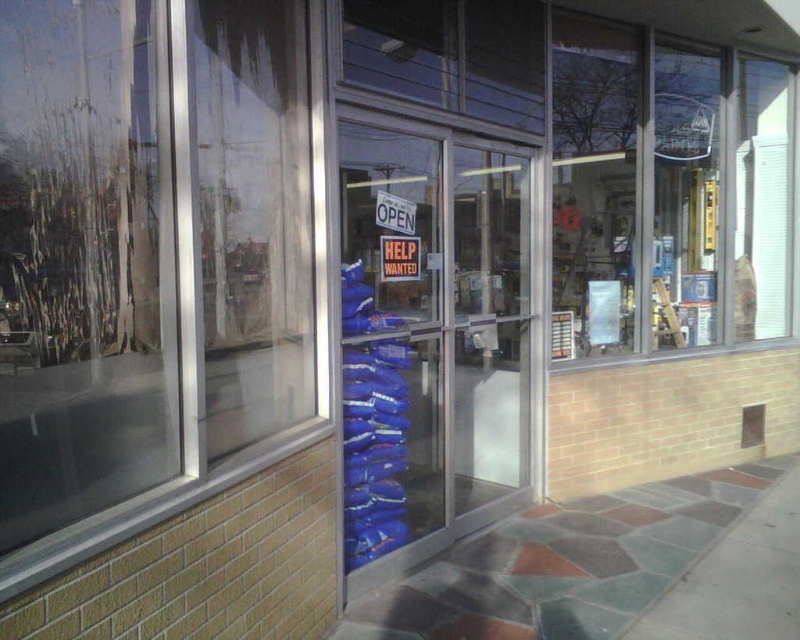
Question: Among these objects, which one is nearest to the camera?

Choices:
 (A) transparent glass window at upper left
 (B) red paper help wanted sign at center

Answer: (A)

Question: Considering the relative positions of transparent glass window at upper left and transparent glass door at center in the image provided, where is transparent glass window at upper left located with respect to transparent glass door at center?

Choices:
 (A) below
 (B) above

Answer: (B)

Question: Can you confirm if marble-like stone pavement at center is positioned below marble tile pavement at lower right?

Choices:
 (A) no
 (B) yes

Answer: (A)

Question: Can you confirm if transparent glass door at center is positioned below marble tile pavement at lower right?

Choices:
 (A) no
 (B) yes

Answer: (A)

Question: Which object is the closest to the transparent glass door at center?

Choices:
 (A) red paper help wanted sign at center
 (B) transparent glass window at upper left
 (C) marble tile pavement at lower right

Answer: (A)

Question: Which object appears closest to the camera in this image?

Choices:
 (A) transparent glass door at center
 (B) red paper help wanted sign at center
 (C) marble tile pavement at lower right
 (D) transparent glass window at upper left

Answer: (D)